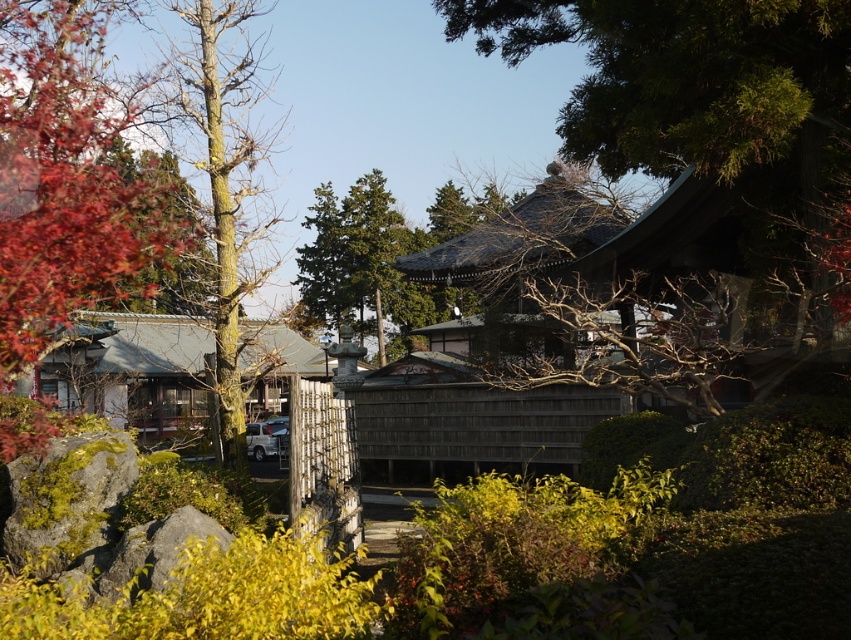
Question: Estimate the real-world distances between objects in this image. Which object is closer to the green textured tree at center?

Choices:
 (A) yellowish bark tree at center
 (B) wooden hut at center
 (C) reddish-brown bark tree at left

Answer: (A)

Question: Estimate the real-world distances between objects in this image. Which object is farther from the wooden hut at center?

Choices:
 (A) green shingled roof at upper center
 (B) green textured tree at center
 (C) yellowish bark tree at center
 (D) reddish-brown bark tree at left

Answer: (B)

Question: Is wooden hut at center bigger than green textured tree at center?

Choices:
 (A) yes
 (B) no

Answer: (B)

Question: Can you confirm if reddish-brown bark tree at left is positioned above yellowish bark tree at center?

Choices:
 (A) no
 (B) yes

Answer: (A)

Question: Does reddish-brown bark tree at left come behind wooden hut at center?

Choices:
 (A) yes
 (B) no

Answer: (A)

Question: Which object appears closest to the camera in this image?

Choices:
 (A) yellowish bark tree at center
 (B) wooden hut at center
 (C) green shingled roof at upper center

Answer: (B)